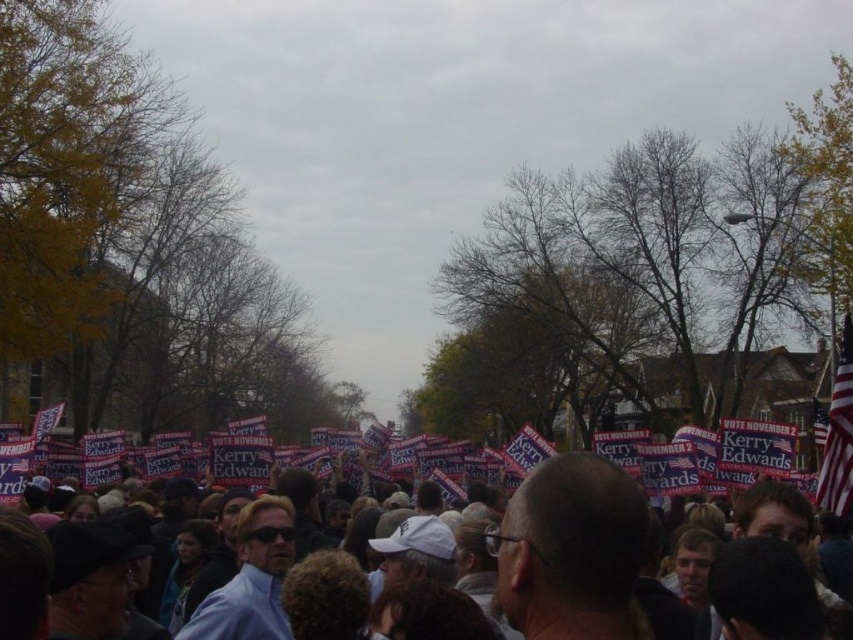
Which is more to the left, red plastic signs at center or american flag at right?

From the viewer's perspective, red plastic signs at center appears more on the left side.

This screenshot has width=853, height=640. Describe the element at coordinates (572, 548) in the screenshot. I see `red plastic signs at center` at that location.

Is point (183, 636) positioned before point (850, 320)?

Yes.

The height and width of the screenshot is (640, 853). What are the coordinates of `red plastic signs at center` in the screenshot? It's located at [572, 548].